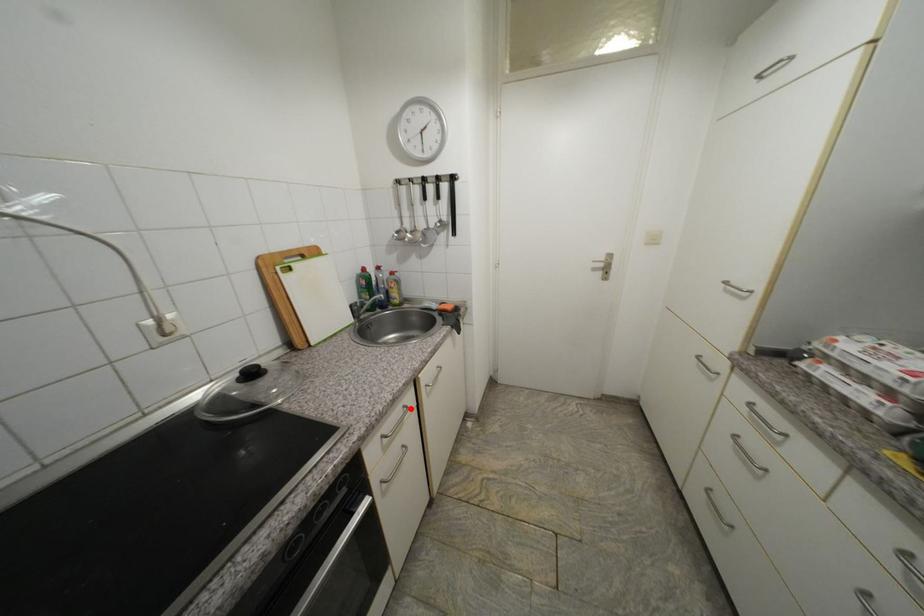
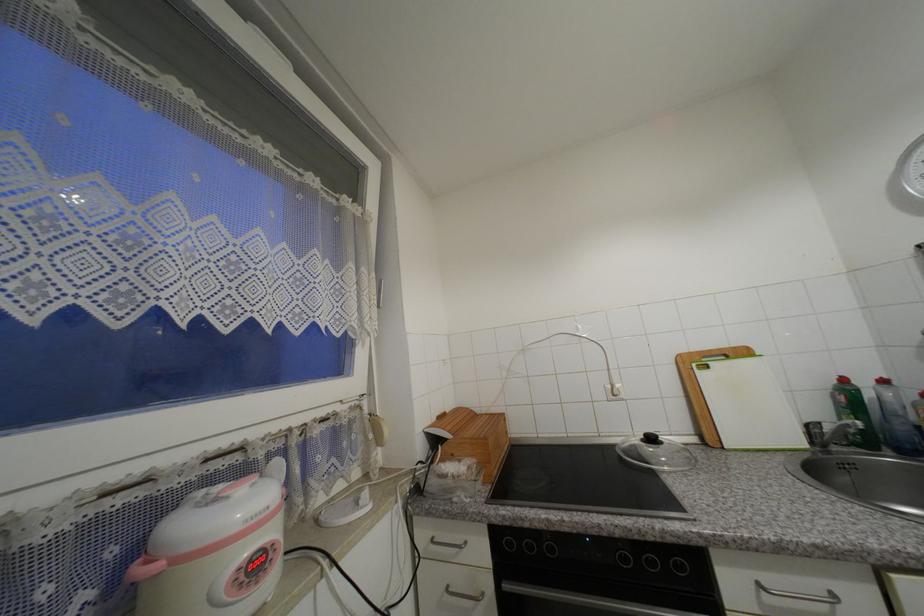
Question: I am providing you with two images of the same scene from different viewpoints. Image1 has a red point marked. In image2, the corresponding 3D location appears at what relative position? Reply with the corresponding letter.

Choices:
 (A) Closer
 (B) Farther

Answer: (A)